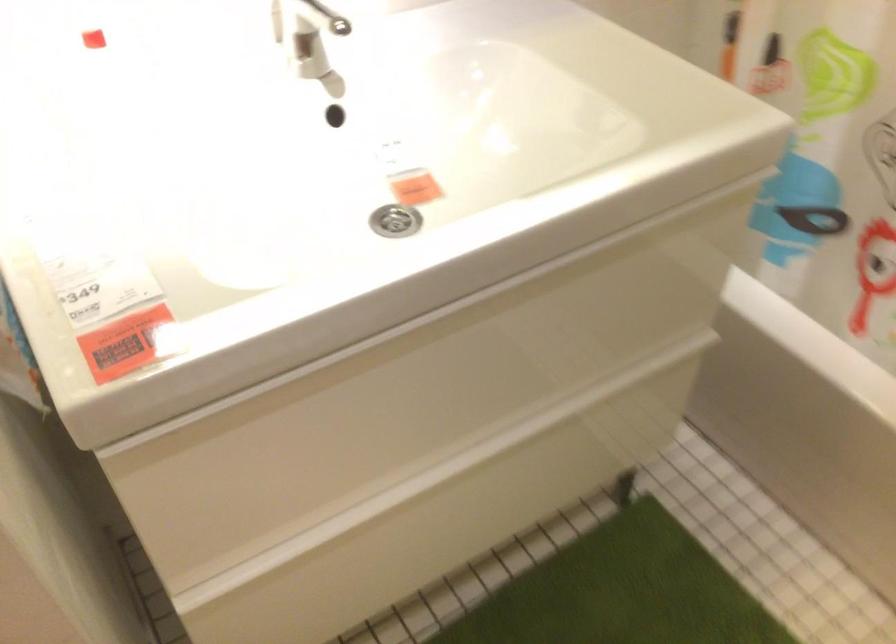
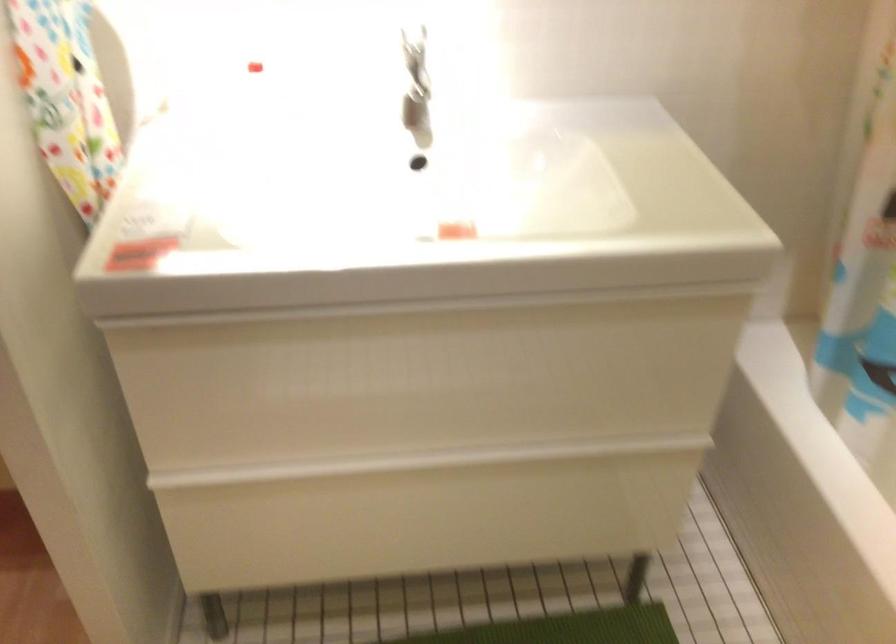
Question: The images are taken continuously from a first-person perspective. In which direction are you moving?

Choices:
 (A) Left
 (B) Right
 (C) Forward
 (D) Backward

Answer: (B)